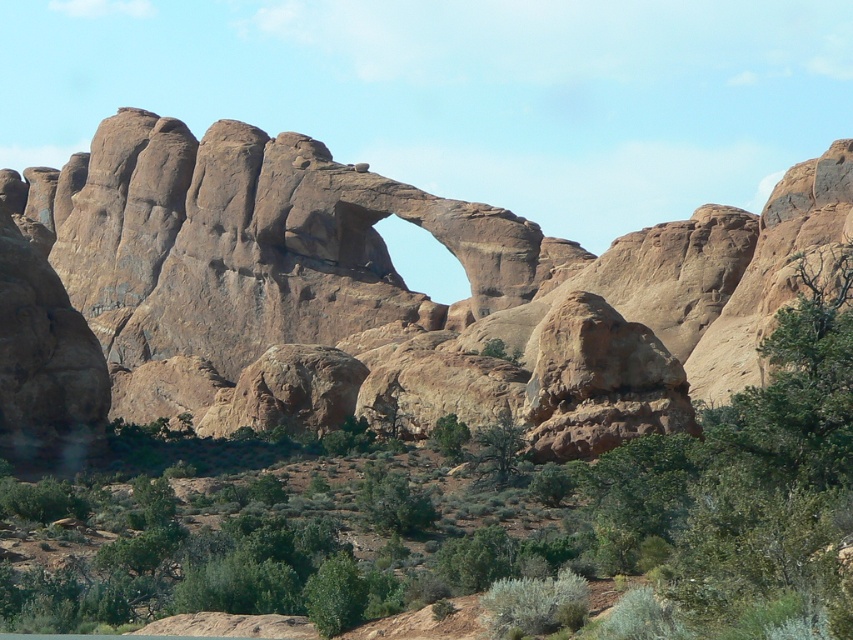
In the scene shown: Can you confirm if rustic sandstone arch at center is smaller than green leafy shrubs at center?

Actually, rustic sandstone arch at center might be larger than green leafy shrubs at center.

The width and height of the screenshot is (853, 640). What do you see at coordinates (404, 291) in the screenshot?
I see `rustic sandstone arch at center` at bounding box center [404, 291].

Who is more forward, (x=544, y=378) or (x=833, y=461)?

Positioned in front is point (x=833, y=461).

The width and height of the screenshot is (853, 640). Find the location of `rustic sandstone arch at center`. rustic sandstone arch at center is located at coordinates (404, 291).